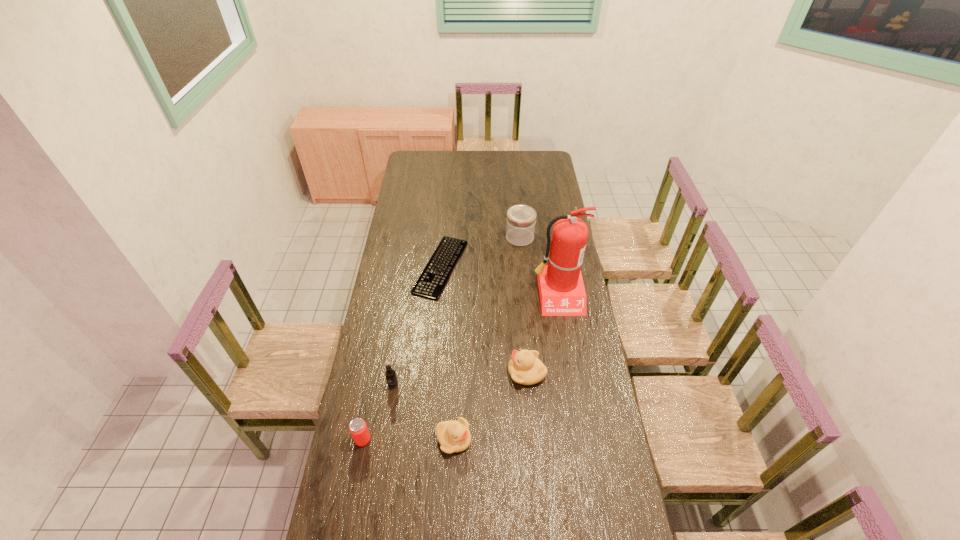
At what (x,y) coordinates should I click in order to perform the action: click on beer can that is at the left edge. Please return your answer as a coordinate pair (x, y). This screenshot has width=960, height=540. Looking at the image, I should click on (358, 428).

Find the location of `object that is at the right edge`. object that is at the right edge is located at coordinates coord(562,293).

At what (x,y) coordinates should I click in order to perform the action: click on vacant space at the far edge of the desktop. Please return your answer as a coordinate pair (x, y). This screenshot has height=540, width=960. Looking at the image, I should click on (516, 161).

The image size is (960, 540). In order to click on vacant space at the near edge of the desktop in this screenshot , I will do `click(502, 514)`.

In the image, there is a desktop. Where is `free space at the left edge`? This screenshot has width=960, height=540. free space at the left edge is located at coordinates (419, 192).

Where is `vacant space at the right edge`? The height and width of the screenshot is (540, 960). vacant space at the right edge is located at coordinates (540, 178).

Where is `vacant region at the near left corner of the desktop`? This screenshot has width=960, height=540. vacant region at the near left corner of the desktop is located at coordinates (380, 502).

Image resolution: width=960 pixels, height=540 pixels. Find the location of `free area in between the tallest object and the root beer`. free area in between the tallest object and the root beer is located at coordinates (475, 340).

Locate an element on the screen. This screenshot has width=960, height=540. unoccupied area between the shortest object and the jar is located at coordinates (480, 252).

Identify the location of free space between the tallest object and the taller duckling. The height and width of the screenshot is (540, 960). (542, 333).